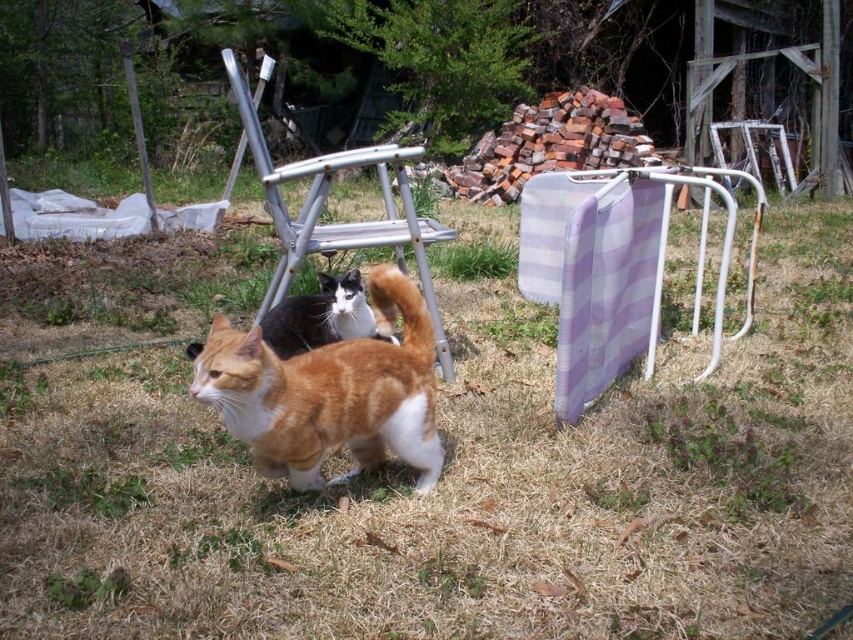
Can you confirm if purple checkered fabric at center is positioned above white metal folding chair at upper right?

No, purple checkered fabric at center is not above white metal folding chair at upper right.

Is purple checkered fabric at center further to the viewer compared to white metal folding chair at upper right?

That is False.

This screenshot has height=640, width=853. What are the coordinates of `purple checkered fabric at center` in the screenshot? It's located at (612, 268).

Can you confirm if orange and white fur cat at center is positioned to the left of orange tabby cat at center?

In fact, orange and white fur cat at center is to the right of orange tabby cat at center.

Can you confirm if orange and white fur cat at center is shorter than orange tabby cat at center?

No, orange and white fur cat at center is not shorter than orange tabby cat at center.

Is point (397, 406) closer to camera compared to point (335, 298)?

Yes, point (397, 406) is in front of point (335, 298).

Where is `orange and white fur cat at center`? This screenshot has width=853, height=640. orange and white fur cat at center is located at coordinates (329, 392).

Who is lower down, purple checkered fabric at center or metallic silver chair at center?

purple checkered fabric at center is lower down.

Is purple checkered fabric at center above metallic silver chair at center?

No, purple checkered fabric at center is not above metallic silver chair at center.

Identify the location of purple checkered fabric at center. The image size is (853, 640). (612, 268).